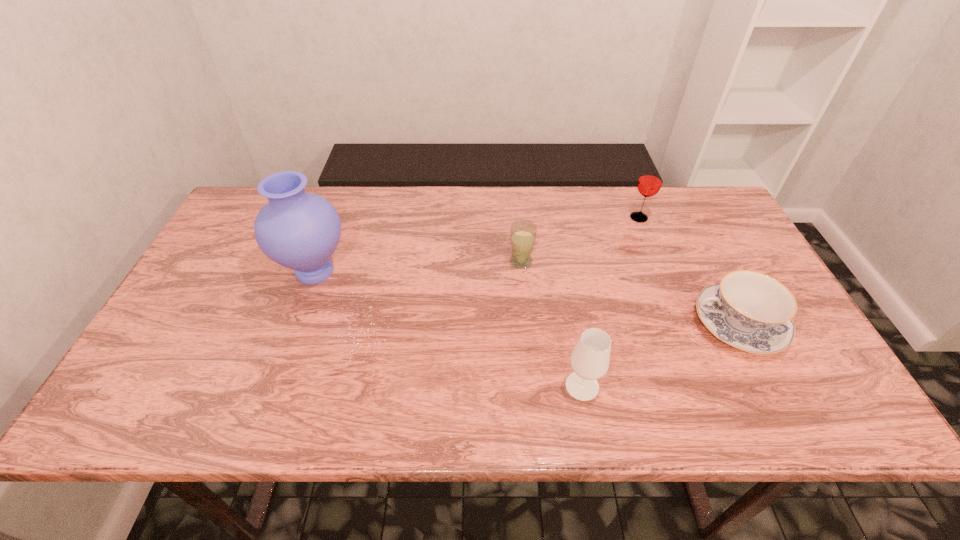
Find the location of a particular element. The image size is (960, 540). vase is located at coordinates (298, 230).

You are a GUI agent. You are given a task and a screenshot of the screen. Output one action in this format:
    pyautogui.click(x=<x>, y=<y>)
    Task: Click on the leftmost object
    Image resolution: width=960 pixels, height=540 pixels.
    Given the screenshot: What is the action you would take?
    pyautogui.click(x=298, y=230)

This screenshot has width=960, height=540. In order to click on the rightmost glass in this screenshot , I will do point(650,181).

This screenshot has height=540, width=960. In order to click on the farthest glass in this screenshot , I will do `click(650, 181)`.

I want to click on the second glass from left to right, so click(x=590, y=358).

Where is `the nearest glass`? the nearest glass is located at coordinates (590, 358).

Find the location of `the second object from left to right`. the second object from left to right is located at coordinates (523, 233).

Find the location of a particular element. The width and height of the screenshot is (960, 540). the shortest glass is located at coordinates (523, 233).

Locate an element on the screen. chinaware is located at coordinates (748, 310).

I want to click on free space located on the right of the tallest object, so click(407, 271).